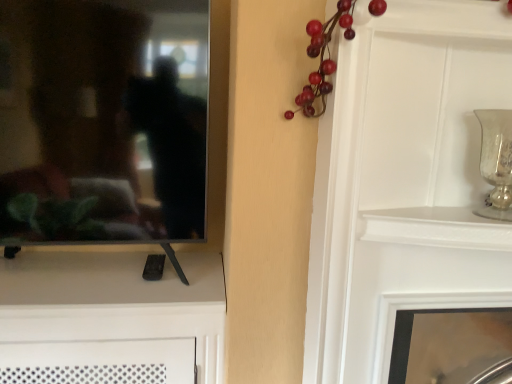
Consider the image. Measure the distance between point [499,183] and camera.

Point [499,183] and camera are 34.88 inches apart.

Measure the distance between silver textured vase at upper right and camera.

34.29 inches.

Describe the element at coordinates (422, 309) in the screenshot. This screenshot has height=384, width=512. I see `white glossy fireplace at lower right` at that location.

Locate an element on the screen. The height and width of the screenshot is (384, 512). black glossy mirror at left is located at coordinates (101, 119).

Is black glossy mirror at left shorter than white glossy fireplace at lower right?

Incorrect, the height of black glossy mirror at left does not fall short of that of white glossy fireplace at lower right.

Considering the sizes of black glossy mirror at left and white glossy fireplace at lower right in the image, is black glossy mirror at left bigger or smaller than white glossy fireplace at lower right?

Clearly, black glossy mirror at left is smaller in size than white glossy fireplace at lower right.

Could white glossy fireplace at lower right be considered to be inside black glossy mirror at left?

No.

Does black glossy mirror at left turn towards white glossy fireplace at lower right?

No, black glossy mirror at left does not turn towards white glossy fireplace at lower right.

Does black glossy mirror at left have a lesser height compared to silver textured vase at upper right?

Incorrect, the height of black glossy mirror at left does not fall short of that of silver textured vase at upper right.

Is black glossy mirror at left facing away from silver textured vase at upper right?

black glossy mirror at left does not have its back to silver textured vase at upper right.

Is black glossy mirror at left at the right side of silver textured vase at upper right?

Incorrect, black glossy mirror at left is not on the right side of silver textured vase at upper right.

Based on the photo, is the surface of black glossy mirror at left in direct contact with silver textured vase at upper right?

There is a gap between black glossy mirror at left and silver textured vase at upper right.

Is white glossy fireplace at lower right surrounding black glossy mirror at left?

No, black glossy mirror at left is located outside of white glossy fireplace at lower right.

From a real-world perspective, is white glossy fireplace at lower right on top of black glossy mirror at left?

No, from a real-world perspective, white glossy fireplace at lower right is not over black glossy mirror at left

Considering the positions of objects white glossy fireplace at lower right and black glossy mirror at left in the image provided, who is behind, white glossy fireplace at lower right or black glossy mirror at left?

Positioned behind is white glossy fireplace at lower right.

Between silver textured vase at upper right and white glossy fireplace at lower right, which one is positioned in front?

silver textured vase at upper right is in front.

Does silver textured vase at upper right have a larger size compared to white glossy fireplace at lower right?

No.

How far apart are silver textured vase at upper right and white glossy fireplace at lower right?

silver textured vase at upper right and white glossy fireplace at lower right are 11.29 inches apart from each other.

Which is more to the right, silver textured vase at upper right or white glossy fireplace at lower right?

white glossy fireplace at lower right.

Is the position of white glossy fireplace at lower right more distant than that of silver textured vase at upper right?

That is True.

Can you tell me how much white glossy fireplace at lower right and silver textured vase at upper right differ in facing direction?

The angular difference between white glossy fireplace at lower right and silver textured vase at upper right is 2.09 degrees.

Does point (434, 295) come in front of point (506, 135)?

That is False.

How far apart are white glossy fireplace at lower right and silver textured vase at upper right?

A distance of 11.29 inches exists between white glossy fireplace at lower right and silver textured vase at upper right.

What's the angular difference between silver textured vase at upper right and black glossy mirror at left's facing directions?

They differ by 4.43 degrees in their facing directions.

From the picture: Is silver textured vase at upper right turned away from black glossy mirror at left?

No.

From a real-world perspective, is silver textured vase at upper right below black glossy mirror at left?

Yes, from a real-world perspective, silver textured vase at upper right is below black glossy mirror at left.

In the scene shown: From the image's perspective, is silver textured vase at upper right located beneath black glossy mirror at left?

Yes.

This screenshot has width=512, height=384. I want to click on fireplace that is behind the black glossy mirror at left, so click(422, 309).

This screenshot has width=512, height=384. In the image, there is a silver textured vase at upper right. Find the location of `mirror above it (from the image's perspective)`. mirror above it (from the image's perspective) is located at coordinates (101, 119).

Looking at the image, which one is located further to silver textured vase at upper right, white glossy fireplace at lower right or black glossy mirror at left?

black glossy mirror at left is positioned further to the anchor silver textured vase at upper right.

Which object lies nearer to the anchor point silver textured vase at upper right, black glossy mirror at left or white glossy fireplace at lower right?

white glossy fireplace at lower right.

From the image, which object appears to be nearer to black glossy mirror at left, silver textured vase at upper right or white glossy fireplace at lower right?

white glossy fireplace at lower right lies closer to black glossy mirror at left than the other object.

Considering their positions, is white glossy fireplace at lower right positioned closer to black glossy mirror at left than silver textured vase at upper right?

white glossy fireplace at lower right.

Looking at the image, which one is located closer to white glossy fireplace at lower right, silver textured vase at upper right or black glossy mirror at left?

silver textured vase at upper right.

Considering their positions, is black glossy mirror at left positioned closer to white glossy fireplace at lower right than silver textured vase at upper right?

Among the two, silver textured vase at upper right is located nearer to white glossy fireplace at lower right.

Locate an element on the screen. The image size is (512, 384). candle holder between black glossy mirror at left and white glossy fireplace at lower right in the horizontal direction is located at coordinates (496, 162).